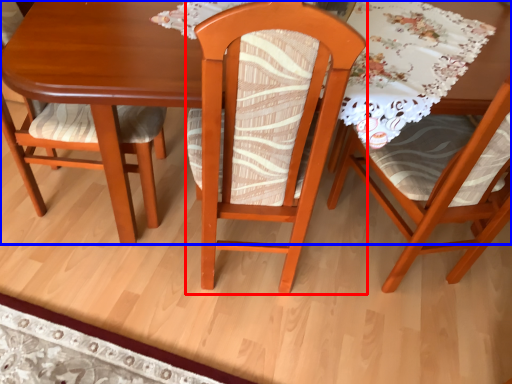
Question: Which of the following is the closest to the observer, chair (highlighted by a red box) or table (highlighted by a blue box)?

Choices:
 (A) chair
 (B) table

Answer: (A)